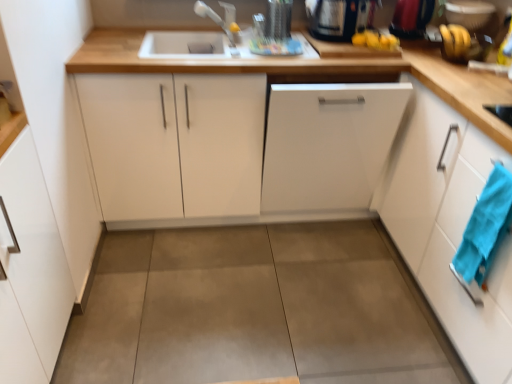
Where is `blank space situated above matte plastic bananas at upper right, positioned as the first appliance in right-to-left order (from a real-world perspective)`? This screenshot has height=384, width=512. blank space situated above matte plastic bananas at upper right, positioned as the first appliance in right-to-left order (from a real-world perspective) is located at coordinates (x=474, y=2).